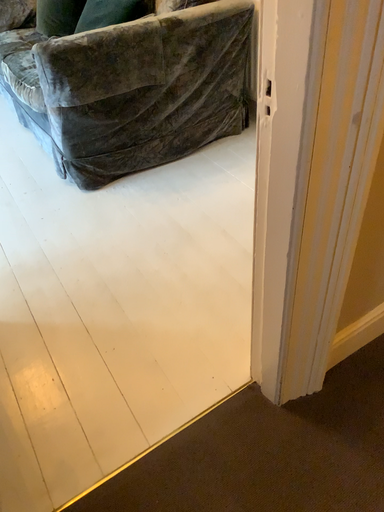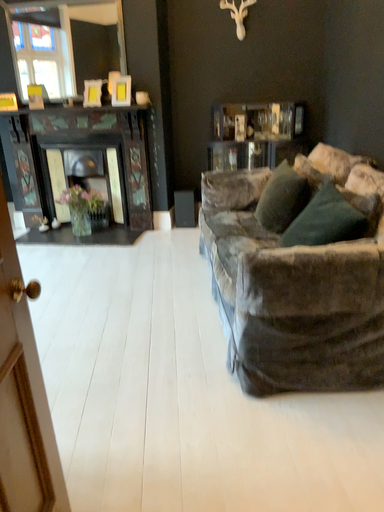
Question: How did the camera likely rotate when shooting the video?

Choices:
 (A) rotated upward
 (B) rotated downward

Answer: (A)